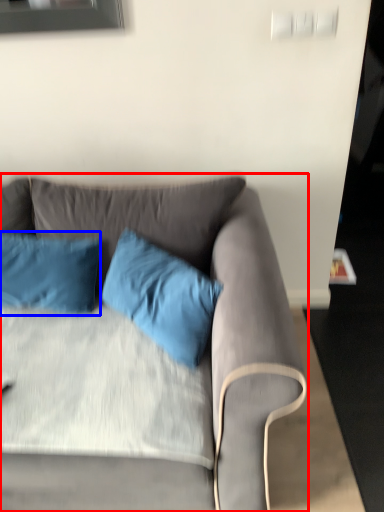
Question: Which of the following is the farthest to the observer, studio couch (highlighted by a red box) or pillow (highlighted by a blue box)?

Choices:
 (A) studio couch
 (B) pillow

Answer: (B)